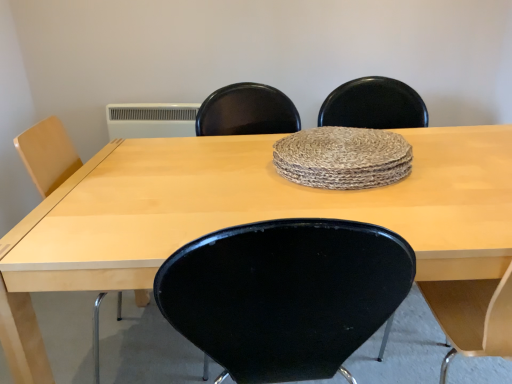
You are a GUI agent. You are given a task and a screenshot of the screen. Output one action in this format:
    pyautogui.click(x=<x>, y=<y>)
    Task: Click on the vacant point above light wood table at center (from a real-world perspective)
    
    Given the screenshot: What is the action you would take?
    pyautogui.click(x=329, y=185)